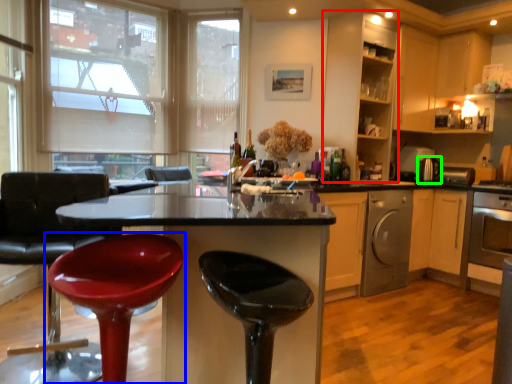
Question: Which object is positioned closest to cabinetry (highlighted by a red box)? Select from chair (highlighted by a blue box) and appliance (highlighted by a green box).

Choices:
 (A) chair
 (B) appliance

Answer: (B)